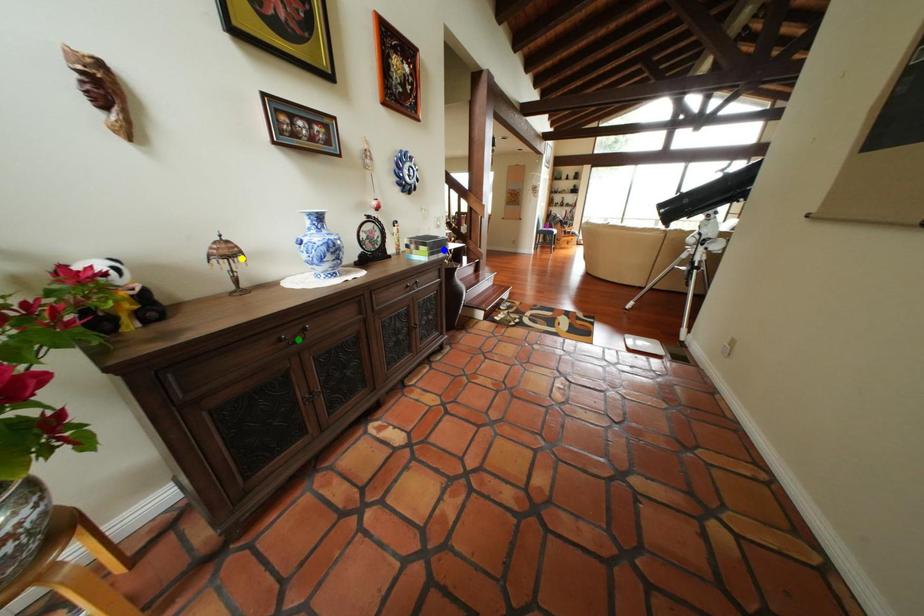
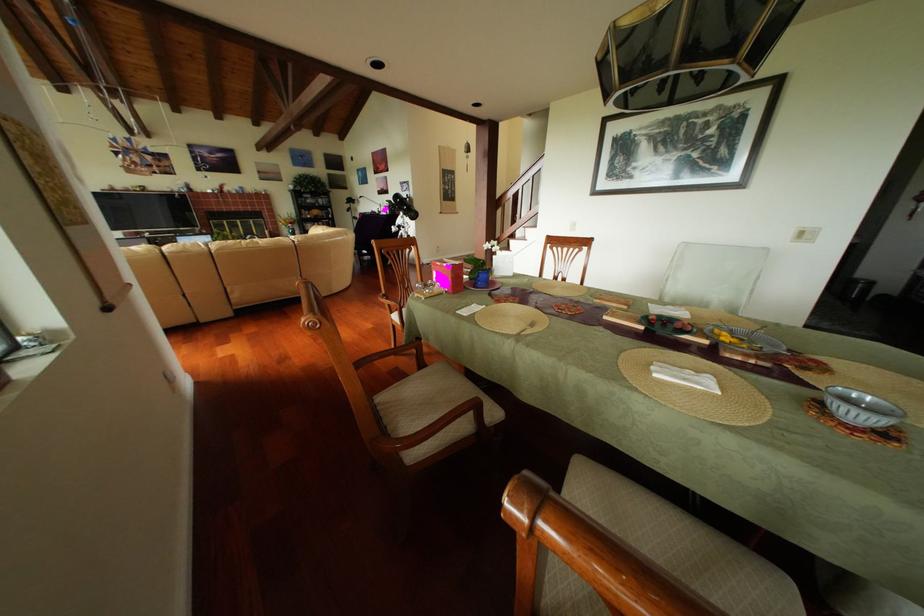
I am providing you with two images of the same scene from different viewpoints. Three points are marked in image1. Which point corresponds to a part or object that is occluded in image2?In image1, three points are marked. Which of them correspond to a part or object that is occluded in image2?Among the three points shown in image1, which one corresponds to a part or object that is no longer visible due to occlusion in image2?

Invisible in image2: green point, blue point, yellow point.